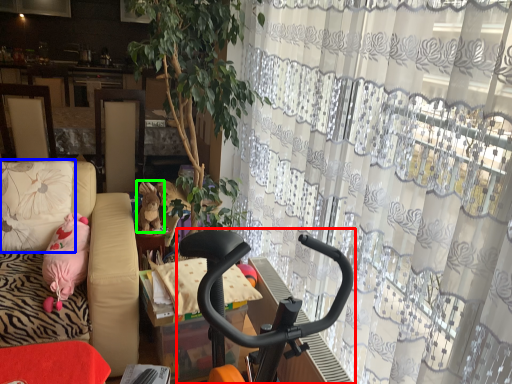
Question: Which object is positioned farthest from baby carriage (highlighted by a red box)? Select from pillow (highlighted by a blue box) and animal (highlighted by a green box).

Choices:
 (A) pillow
 (B) animal

Answer: (A)